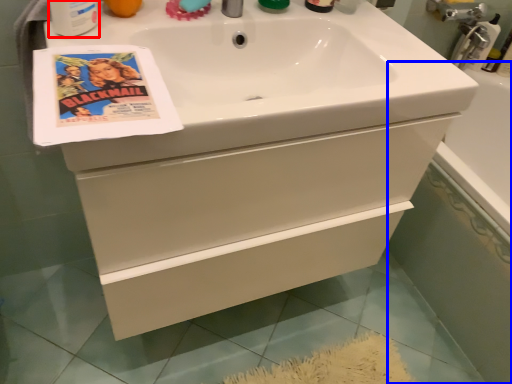
Question: Which point is further to the camera, mouthwash (highlighted by a red box) or bath (highlighted by a blue box)?

Choices:
 (A) mouthwash
 (B) bath

Answer: (B)